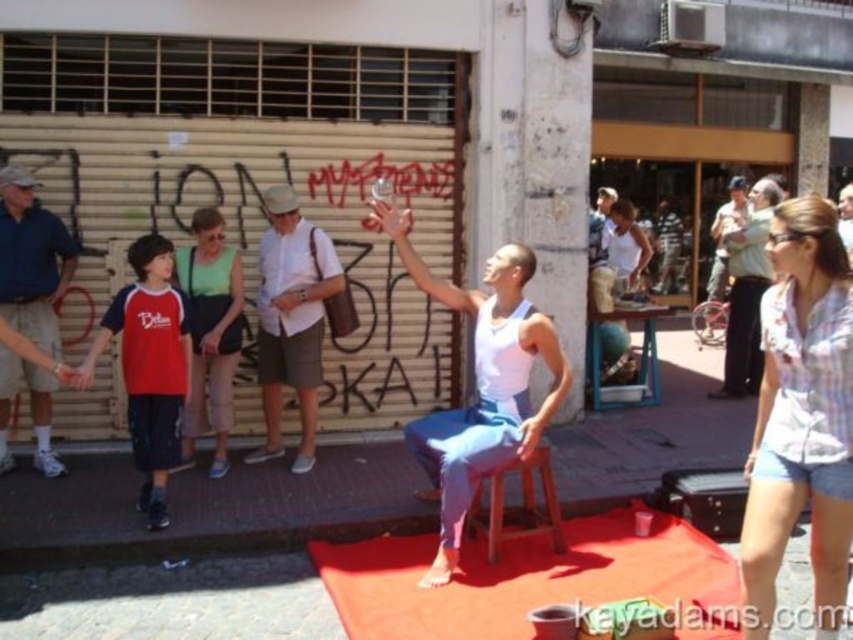
You are a photographer trying to capture a candid shot of the performer and the audience. You notice the red cotton shirt at left and the green fabric dress at center. Which clothing item is positioned lower in the image?

The red cotton shirt at left is located below the green fabric dress at center, so it is positioned lower in the image.

You are a photographer trying to capture both the red cotton shirt at left and the green fabric dress at center in a single frame. Based on their widths, which one should you adjust your camera angle to focus on first to ensure both are fully visible?

The red cotton shirt at left might be wider than green fabric dress at center, so you should focus on the red cotton shirt at left first to accommodate its wider width in the frame.